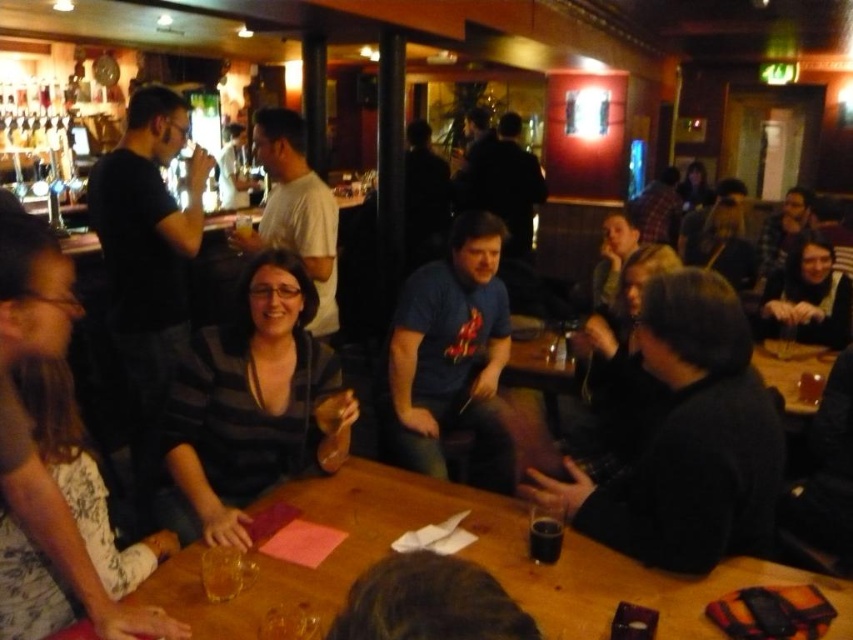
Question: Which object is closer to the camera taking this photo?

Choices:
 (A) black fuzzy jacket at right
 (B) striped fabric shirt at center
 (C) black glass at table center
 (D) wooden table at center

Answer: (D)

Question: Can you confirm if black fuzzy jacket at right is wider than striped fabric shirt at center?

Choices:
 (A) no
 (B) yes

Answer: (B)

Question: Considering the real-world distances, which object is farthest from the black glass at table center?

Choices:
 (A) striped fabric shirt at center
 (B) black fuzzy jacket at right
 (C) wooden table at center

Answer: (A)

Question: Estimate the real-world distances between objects in this image. Which object is closer to the black glass at table center?

Choices:
 (A) striped fabric shirt at center
 (B) wooden table at center

Answer: (B)

Question: Is wooden table at center below striped fabric shirt at center?

Choices:
 (A) no
 (B) yes

Answer: (B)

Question: Observing the image, what is the correct spatial positioning of wooden table at center in reference to black glass at table center?

Choices:
 (A) below
 (B) above

Answer: (A)